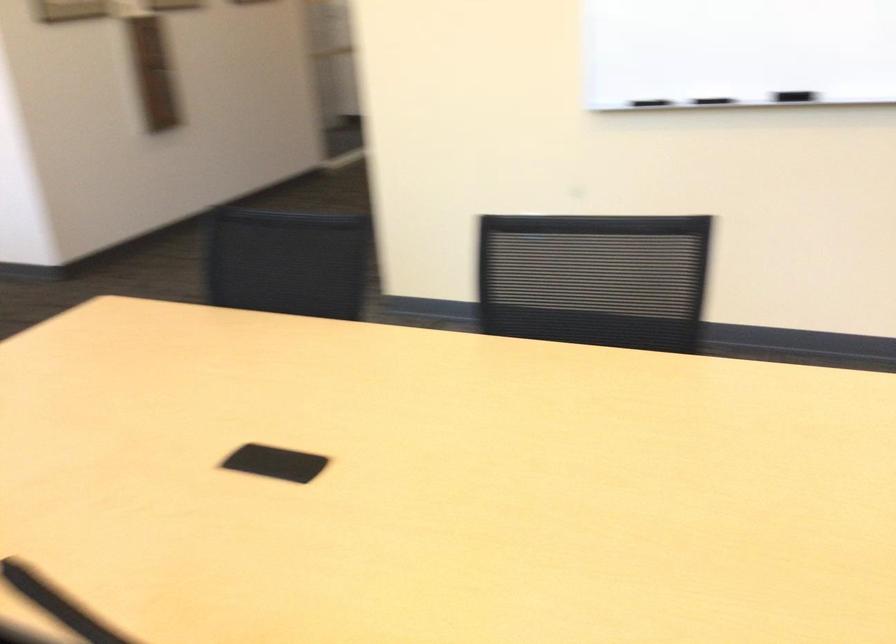
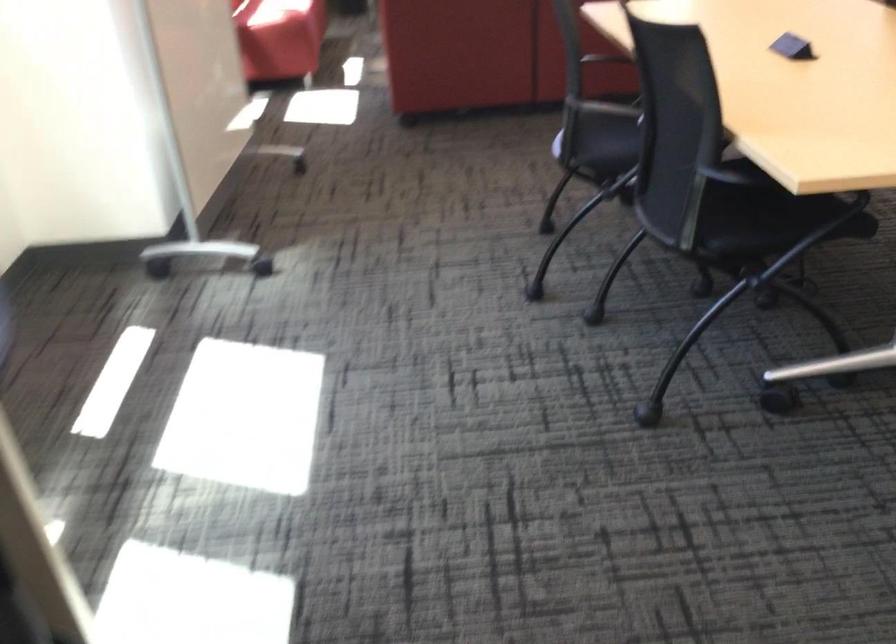
Based on the continuous images, in which direction is the camera rotating?

The camera rotated toward left-down.